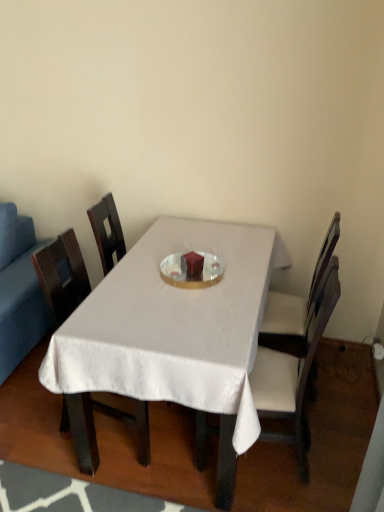
Question: Considering the relative positions of white fabric chair at center, marked as the 2th chair in a left-to-right arrangement, and white satin table at center in the image provided, is white fabric chair at center, marked as the 2th chair in a left-to-right arrangement, to the left of white satin table at center from the viewer's perspective?

Choices:
 (A) yes
 (B) no

Answer: (B)

Question: Does white fabric chair at center, the second chair from the right, have a lesser width compared to white satin table at center?

Choices:
 (A) no
 (B) yes

Answer: (B)

Question: Are white fabric chair at center, marked as the 2th chair in a left-to-right arrangement, and white satin table at center making contact?

Choices:
 (A) yes
 (B) no

Answer: (B)

Question: From a real-world perspective, is white fabric chair at center, marked as the 2th chair in a left-to-right arrangement, under white satin table at center?

Choices:
 (A) no
 (B) yes

Answer: (A)

Question: From the image's perspective, is white fabric chair at center, the second chair from the right, over white satin table at center?

Choices:
 (A) no
 (B) yes

Answer: (A)

Question: Is point (6, 338) positioned closer to the camera than point (296, 355)?

Choices:
 (A) farther
 (B) closer

Answer: (A)

Question: Is blue fabric couch at left spatially inside white fabric chair at center, the second chair from the right, or outside of it?

Choices:
 (A) outside
 (B) inside

Answer: (A)

Question: Based on their sizes in the image, would you say blue fabric couch at left is bigger or smaller than white fabric chair at center, marked as the 2th chair in a left-to-right arrangement?

Choices:
 (A) small
 (B) big

Answer: (B)

Question: Considering the positions of blue fabric couch at left and white fabric chair at center, marked as the 2th chair in a left-to-right arrangement, in the image, is blue fabric couch at left wider or thinner than white fabric chair at center, marked as the 2th chair in a left-to-right arrangement,?

Choices:
 (A) thin
 (B) wide

Answer: (B)

Question: In the image, is white satin table at center positioned in front of or behind wooden chair at center, marked as the first chair in a left-to-right arrangement?

Choices:
 (A) behind
 (B) front

Answer: (B)

Question: Is point (241, 350) positioned closer to the camera than point (72, 278)?

Choices:
 (A) farther
 (B) closer

Answer: (B)

Question: From a real-world perspective, is white satin table at center positioned above or below wooden chair at center, which is the 3th chair from right to left?

Choices:
 (A) below
 (B) above

Answer: (A)

Question: Considering the positions of white satin table at center and wooden chair at center, which is the 3th chair from right to left, in the image, is white satin table at center bigger or smaller than wooden chair at center, which is the 3th chair from right to left,?

Choices:
 (A) big
 (B) small

Answer: (A)

Question: Does point (114, 373) appear closer or farther from the camera than point (8, 270)?

Choices:
 (A) farther
 (B) closer

Answer: (B)

Question: Based on their sizes in the image, would you say white satin table at center is bigger or smaller than blue fabric couch at left?

Choices:
 (A) big
 (B) small

Answer: (A)